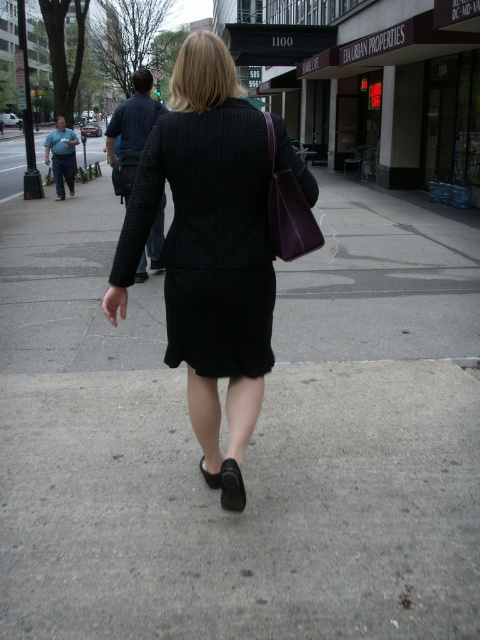
From the picture: You are standing at the center of the sidewalk and see the point marked at (208, 250). What object is located at that point?

The point at (208, 250) represents the matte black skirt at center.

Based on the scene description, which object is positioned lower in the image? The matte black skirt at center or the black textured blazer at upper center?

The matte black skirt at center is positioned below the black textured blazer at upper center, so the matte black skirt at center is lower in the image.